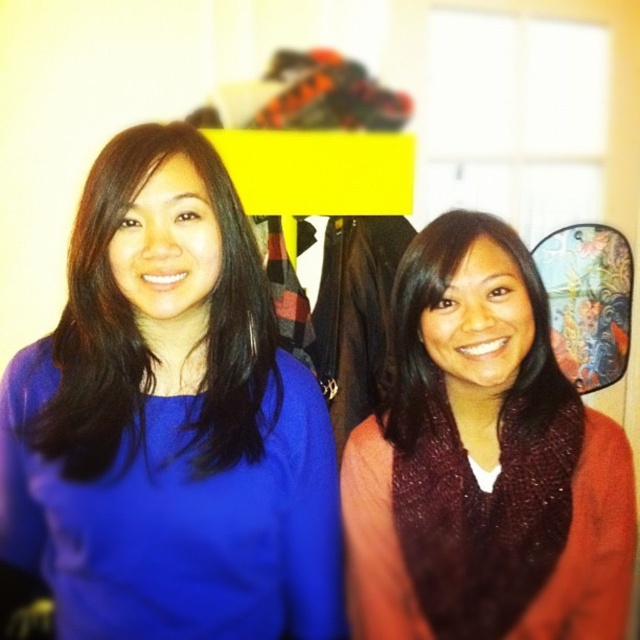
Question: Estimate the real-world distances between objects in this image. Which object is closer to the matte maroon sweater at center?

Choices:
 (A) matte blue sweater at center
 (B) knitted maroon scarf at center

Answer: (B)

Question: Where is matte blue sweater at center located in relation to matte maroon sweater at center in the image?

Choices:
 (A) above
 (B) below

Answer: (B)

Question: Which object appears closest to the camera in this image?

Choices:
 (A) knitted maroon scarf at center
 (B) matte blue sweater at center
 (C) matte maroon sweater at center

Answer: (B)

Question: Estimate the real-world distances between objects in this image. Which object is farther from the matte maroon sweater at center?

Choices:
 (A) knitted maroon scarf at center
 (B) matte blue sweater at center

Answer: (B)

Question: Is matte blue sweater at center above matte maroon sweater at center?

Choices:
 (A) no
 (B) yes

Answer: (A)

Question: Is knitted maroon scarf at center wider than matte maroon sweater at center?

Choices:
 (A) yes
 (B) no

Answer: (A)